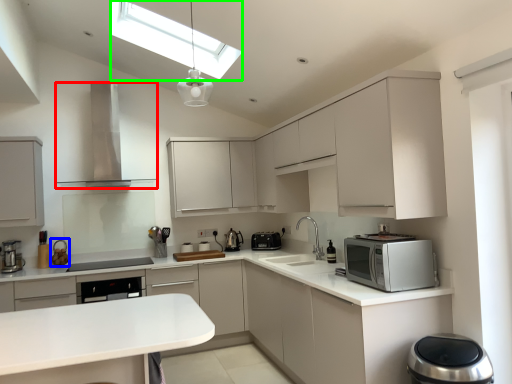
Question: Which is farther away from home appliance (highlighted by a red box)? appliance (highlighted by a blue box) or lighting (highlighted by a green box)?

Choices:
 (A) appliance
 (B) lighting

Answer: (A)